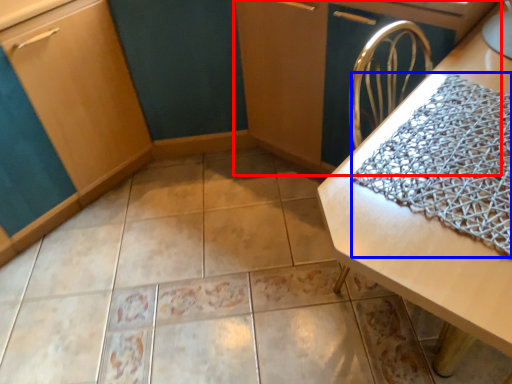
Question: Which of the following is the closest to the observer, dresser (highlighted by a red box) or blanket (highlighted by a blue box)?

Choices:
 (A) dresser
 (B) blanket

Answer: (B)